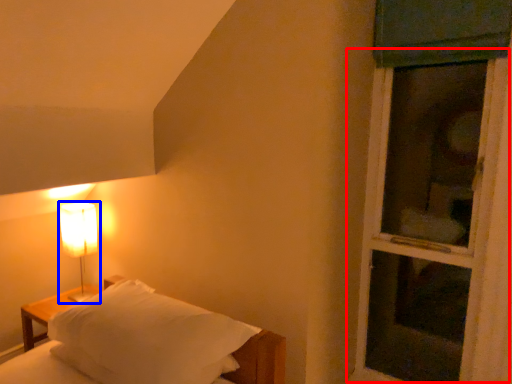
Question: Which of the following is the farthest to the observer, screen door (highlighted by a red box) or lamp (highlighted by a blue box)?

Choices:
 (A) screen door
 (B) lamp

Answer: (B)